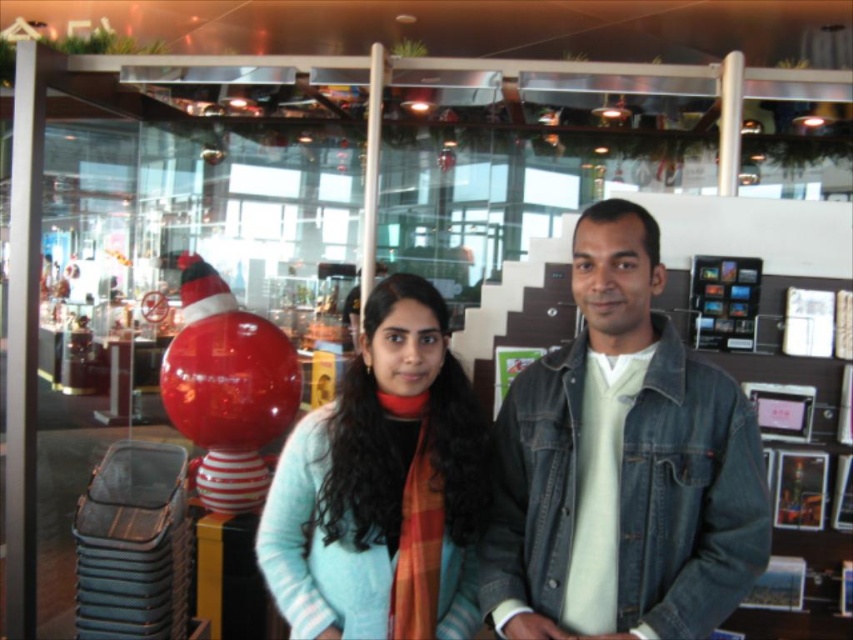
Where is `denim jacket at center`? Image resolution: width=853 pixels, height=640 pixels. denim jacket at center is located at coordinates (622, 467).

Who is lower down, denim jacket at center or glossy red balloon at center?

glossy red balloon at center

What are the coordinates of `denim jacket at center` in the screenshot? It's located at (622, 467).

Where is `denim jacket at center`? denim jacket at center is located at coordinates (622, 467).

Can you confirm if light blue sweater at center is wider than glossy red balloon at center?

No, light blue sweater at center is not wider than glossy red balloon at center.

Is point (419, 476) closer to viewer compared to point (218, 348)?

That is True.

Which is in front, point (293, 572) or point (195, 340)?

Point (293, 572) is more forward.

This screenshot has height=640, width=853. What are the coordinates of `light blue sweater at center` in the screenshot? It's located at (381, 486).

Between point (724, 557) and point (471, 525), which one is positioned behind?

The point (471, 525) is more distant.

Is denim jacket at center to the right of light blue sweater at center from the viewer's perspective?

Yes, denim jacket at center is to the right of light blue sweater at center.

What do you see at coordinates (622, 467) in the screenshot? I see `denim jacket at center` at bounding box center [622, 467].

Locate an element on the screen. denim jacket at center is located at coordinates (622, 467).